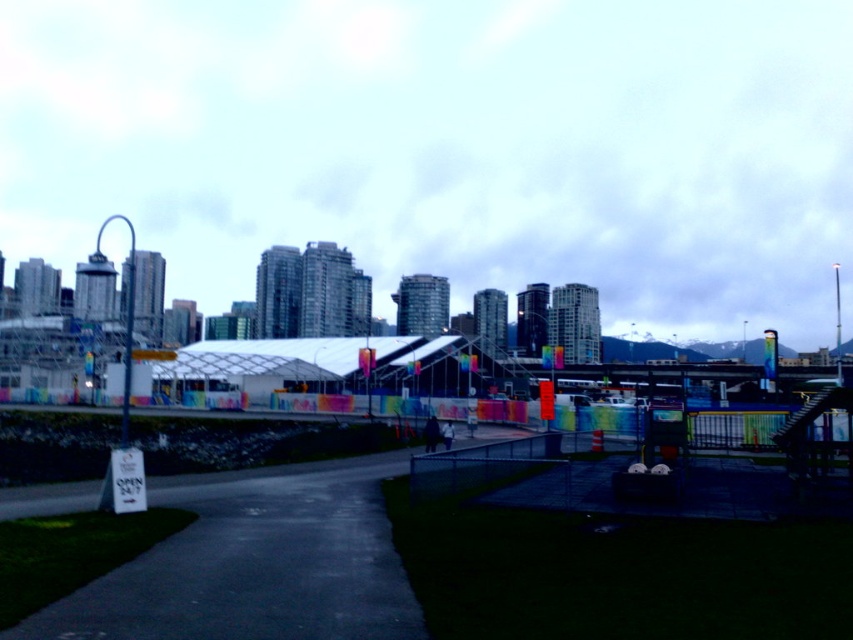
You are standing in the urban scene and want to reach the transparent glass canopy at center. Considering the distance, is it feasible to walk there within 10 minutes at a normal walking speed?

The transparent glass canopy at center is 244.60 meters away. At a normal walking speed of about 1.4 meters per second, it would take approximately 174.7 seconds, which is roughly 2.9 minutes. Therefore, it is feasible to walk there within 10 minutes.

You are a drone operator trying to capture aerial footage of the transparent glass canopy at center. You need to position your drone at coordinates that are 0.1 units to the north of the canopy. What coordinates should you set your drone to?

The transparent glass canopy at center is located at point (450, 147). To position the drone 0.1 units north, add 0.1 to the y coordinate. The new coordinates would be (535, 147).